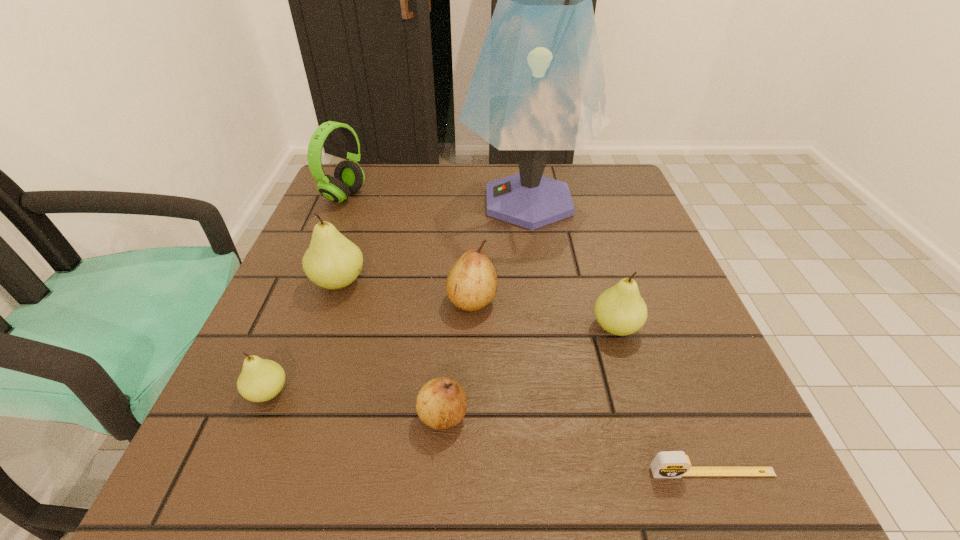
Image resolution: width=960 pixels, height=540 pixels. In order to click on light lampshade in this screenshot , I will do `click(539, 85)`.

Where is `lampshade`? This screenshot has height=540, width=960. lampshade is located at coordinates coord(539,85).

Identify the location of headset. (349, 177).

Locate an element on the screen. The image size is (960, 540). the biggest green pear is located at coordinates (332, 261).

I want to click on the farthest green pear, so click(332, 261).

Identify the location of the second nearest green pear. (620, 310).

Identify the location of the rightmost green pear. The height and width of the screenshot is (540, 960). (620, 310).

This screenshot has height=540, width=960. Find the location of `the farther brown pear`. the farther brown pear is located at coordinates (472, 283).

Locate an element on the screen. the nearest green pear is located at coordinates (261, 380).

The image size is (960, 540). Find the location of `the nearer brown pear`. the nearer brown pear is located at coordinates (441, 403).